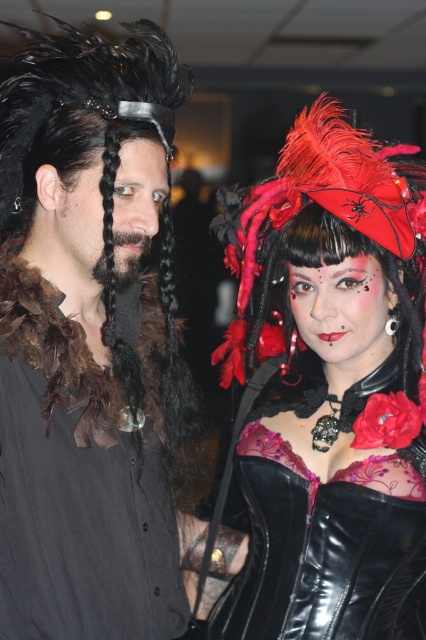
Between point (399, 561) and point (348, 198), which one is positioned behind?

The point (399, 561) is more distant.

Is point (230, 604) farther from viewer compared to point (330, 156)?

Yes, point (230, 604) is behind point (330, 156).

This screenshot has height=640, width=426. In order to click on matte black corset at center in this screenshot , I will do `click(328, 388)`.

Can you confirm if matte black shirt at center is positioned to the right of velvet red headdress at upper right?

No, matte black shirt at center is not to the right of velvet red headdress at upper right.

Identify the location of matte black shirt at center. (89, 342).

At what (x,y) coordinates should I click in order to perform the action: click on matte black shirt at center. Please return your answer as a coordinate pair (x, y). This screenshot has width=426, height=640. Looking at the image, I should click on (89, 342).

Is point (137, 502) behind point (391, 593)?

No, it is not.

Can you confirm if matte black shirt at center is shorter than matte black corset at center?

Indeed, matte black shirt at center has a lesser height compared to matte black corset at center.

Is point (3, 132) positioned behind point (356, 132)?

No.

What are the coordinates of `matte black shirt at center` in the screenshot? It's located at (89, 342).